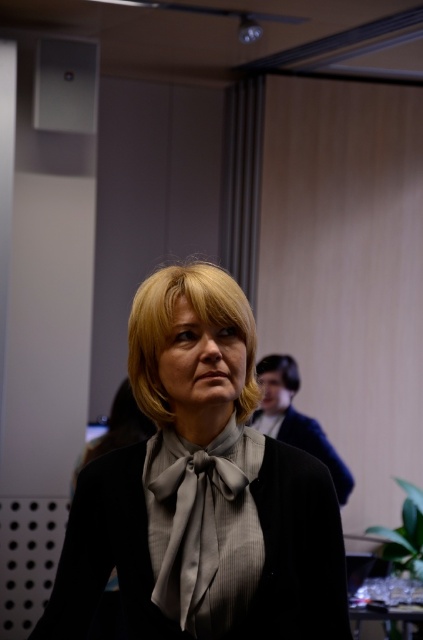
Can you confirm if gray satin tie at center is bigger than blonde hair at upper right?

Actually, gray satin tie at center might be smaller than blonde hair at upper right.

Between point (209, 579) and point (282, 362), which one is positioned behind?

The point (282, 362) is behind.

Where is `gray satin tie at center`? gray satin tie at center is located at coordinates (192, 531).

Can you confirm if gray satin tie at center is bigger than black satin business suit at center?

Incorrect, gray satin tie at center is not larger than black satin business suit at center.

Can you confirm if gray satin tie at center is smaller than black satin business suit at center?

Indeed, gray satin tie at center has a smaller size compared to black satin business suit at center.

Who is more distant from viewer, (176,577) or (323,461)?

The point (323,461) is behind.

Locate an element on the screen. The image size is (423, 640). gray satin tie at center is located at coordinates point(192,531).

Can you confirm if matte gray blouse at center is taller than blonde hair at upper right?

Yes, matte gray blouse at center is taller than blonde hair at upper right.

From the picture: Who is more forward, (208, 589) or (277, 368)?

Positioned in front is point (208, 589).

Is point (79, 486) more distant than point (294, 378)?

No, (79, 486) is in front of (294, 378).

Find the location of `matte gray blouse at center`. matte gray blouse at center is located at coordinates (200, 492).